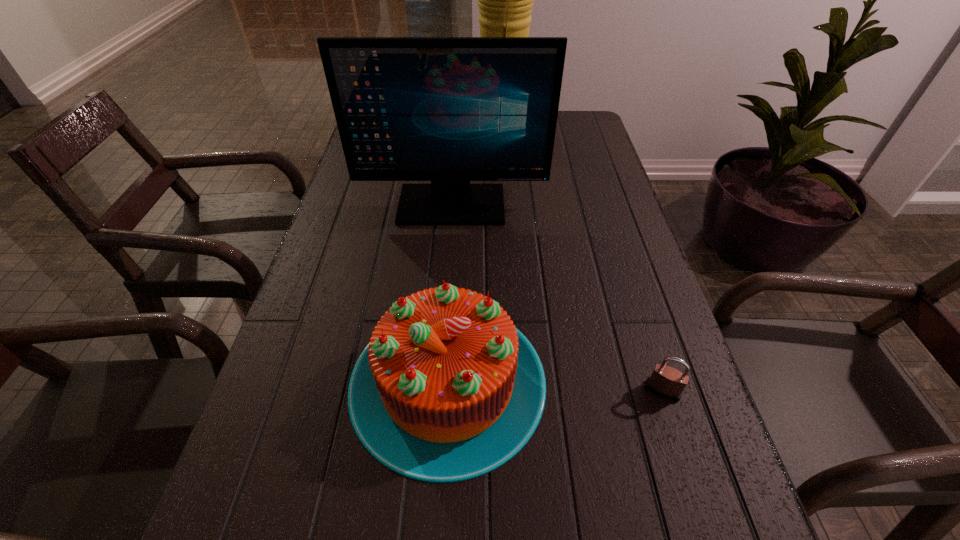
This screenshot has width=960, height=540. Find the location of `trophy cup`. trophy cup is located at coordinates coord(505,0).

Find the location of `the tallest object`. the tallest object is located at coordinates (505, 0).

At what (x,y) coordinates should I click in order to perform the action: click on the third shortest object. Please return your answer as a coordinate pair (x, y). This screenshot has height=540, width=960. Looking at the image, I should click on (450, 110).

Where is `monitor`? The image size is (960, 540). monitor is located at coordinates (450, 110).

Identify the location of the second shortest object. Image resolution: width=960 pixels, height=540 pixels. coord(448,389).

Locate an element on the screen. The width and height of the screenshot is (960, 540). padlock is located at coordinates (666, 382).

Where is `the shortest object`? The width and height of the screenshot is (960, 540). the shortest object is located at coordinates (666, 382).

Where is `vacant space situated at the front of the farthest object with handles`? The width and height of the screenshot is (960, 540). vacant space situated at the front of the farthest object with handles is located at coordinates (435, 131).

Identify the location of blank area located at the front of the farthest object with handles. This screenshot has width=960, height=540. (450, 131).

The image size is (960, 540). I want to click on vacant space positioned 0.070m at the front of the farthest object with handles, so click(x=454, y=131).